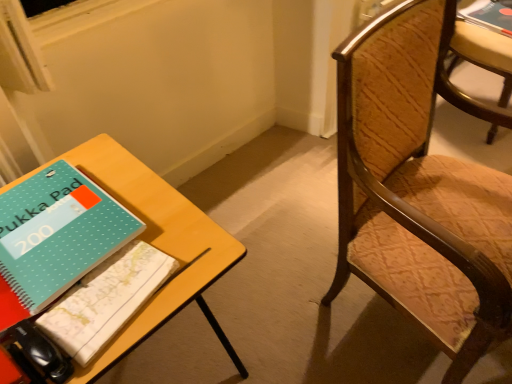
Question: Should I look upward or downward to see wooden textured chair at right, the 2th chair viewed from the right?

Choices:
 (A) down
 (B) up

Answer: (A)

Question: Is wooden textured chair at right, which ranks as the 1th chair in left-to-right order, to the left of wooden textured chair at right, which is counted as the second chair, starting from the left, from the viewer's perspective?

Choices:
 (A) yes
 (B) no

Answer: (A)

Question: From a real-world perspective, is wooden textured chair at right, the second chair from the back, on wooden textured chair at right, acting as the 2th chair starting from the front?

Choices:
 (A) yes
 (B) no

Answer: (A)

Question: From the image's perspective, is wooden textured chair at right, which ranks as the 1th chair in left-to-right order, under wooden textured chair at right, the first chair when ordered from back to front?

Choices:
 (A) yes
 (B) no

Answer: (A)

Question: Can you confirm if wooden textured chair at right, acting as the 1th chair starting from the front, is thinner than wooden textured chair at right, which is counted as the second chair, starting from the left?

Choices:
 (A) yes
 (B) no

Answer: (B)

Question: Is wooden textured chair at right, which ranks as the 1th chair in left-to-right order, shorter than wooden textured chair at right, the first chair when ordered from back to front?

Choices:
 (A) yes
 (B) no

Answer: (B)

Question: Is the depth of wooden textured chair at right, acting as the 1th chair starting from the front, greater than that of wooden textured chair at right, the first chair when ordered from back to front?

Choices:
 (A) no
 (B) yes

Answer: (A)

Question: Does yellow wood table at lower left have a smaller size compared to teal dotted notebook at lower left, which appears as the first book when ordered from the bottom?

Choices:
 (A) no
 (B) yes

Answer: (A)

Question: From a real-world perspective, is yellow wood table at lower left on teal dotted notebook at lower left, positioned as the 2th book in right-to-left order?

Choices:
 (A) yes
 (B) no

Answer: (B)

Question: Can you confirm if yellow wood table at lower left is taller than teal dotted notebook at lower left, which is counted as the 3th book, starting from the top?

Choices:
 (A) yes
 (B) no

Answer: (A)

Question: From a real-world perspective, is yellow wood table at lower left under teal dotted notebook at lower left, marked as the 2th book in a left-to-right arrangement?

Choices:
 (A) yes
 (B) no

Answer: (A)

Question: Considering the relative positions of yellow wood table at lower left and teal dotted notebook at lower left, positioned as the 3th book in back-to-front order, in the image provided, is yellow wood table at lower left in front of teal dotted notebook at lower left, positioned as the 3th book in back-to-front order,?

Choices:
 (A) yes
 (B) no

Answer: (A)

Question: Is yellow wood table at lower left shorter than teal dotted notebook at lower left, which appears as the first book when ordered from the bottom?

Choices:
 (A) yes
 (B) no

Answer: (B)

Question: Considering the relative positions of yellow wood table at lower left and wooden textured chair at right, acting as the 1th chair starting from the front, in the image provided, is yellow wood table at lower left in front of wooden textured chair at right, acting as the 1th chair starting from the front,?

Choices:
 (A) no
 (B) yes

Answer: (A)